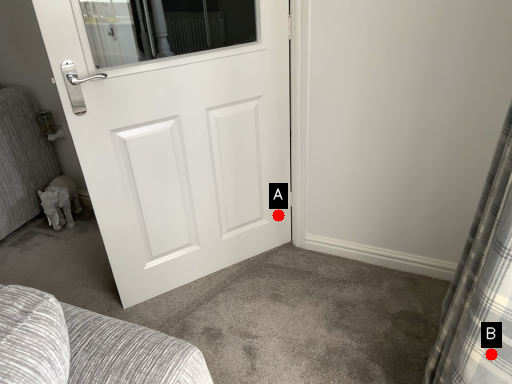
Question: Two points are circled on the image, labeled by A and B beside each circle. Among these points, which one is farthest from the camera?

Choices:
 (A) A is further
 (B) B is further

Answer: (A)